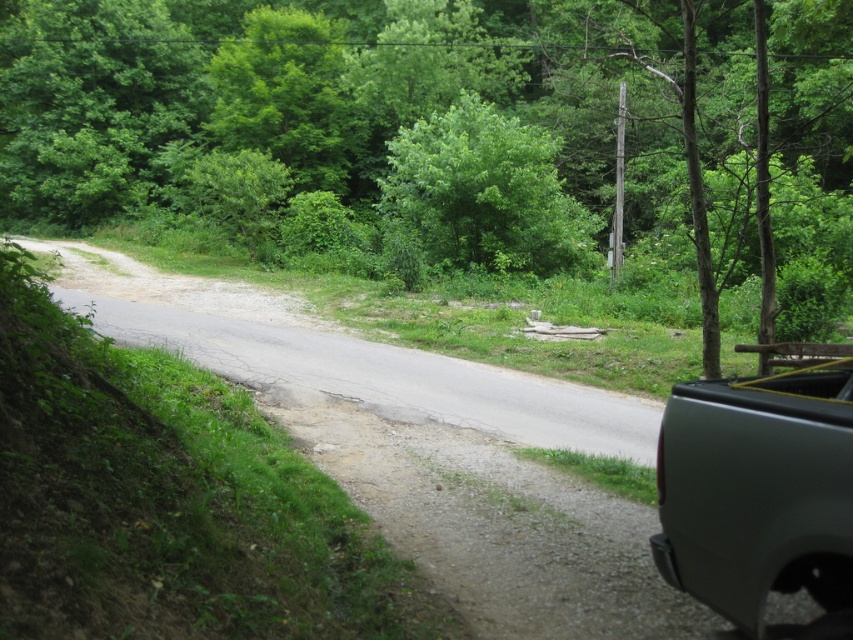
Who is positioned more to the right, green leafy tree at upper center or green leafy tree at center?

green leafy tree at upper center is more to the right.

Does green leafy tree at upper center have a lesser height compared to green leafy tree at center?

No, green leafy tree at upper center is not shorter than green leafy tree at center.

Which is behind, point (223, 42) or point (567, 211)?

The point (223, 42) is behind.

Find the location of a particular element. This screenshot has width=853, height=640. green leafy tree at upper center is located at coordinates (430, 109).

Between satin gray truck at right and green leafy tree at center, which one is positioned higher?

green leafy tree at center is above.

Does point (695, 404) lie behind point (560, 200)?

No.

Between point (697, 381) and point (477, 116), which one is positioned behind?

The point (477, 116) is behind.

This screenshot has width=853, height=640. Find the location of `satin gray truck at right`. satin gray truck at right is located at coordinates (759, 493).

Which of these two, gray matte truck at right or satin gray truck at right, stands shorter?

With less height is satin gray truck at right.

Is gray matte truck at right bigger than satin gray truck at right?

Correct, gray matte truck at right is larger in size than satin gray truck at right.

This screenshot has height=640, width=853. I want to click on gray matte truck at right, so click(x=714, y=141).